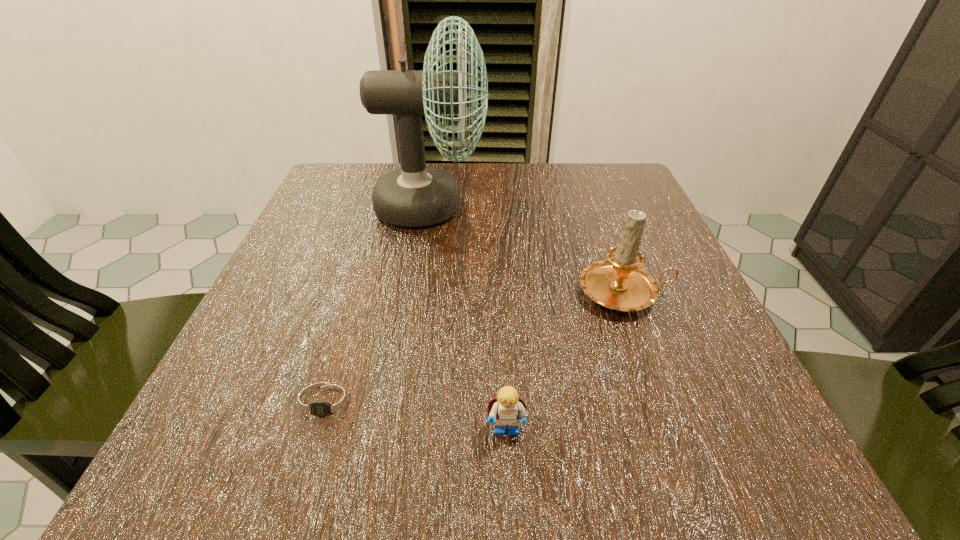
This screenshot has height=540, width=960. I want to click on the tallest object, so click(415, 195).

In order to click on the farthest object in this screenshot , I will do `click(415, 195)`.

Where is `the second tallest object`? the second tallest object is located at coordinates (619, 283).

Locate an element on the screen. candle is located at coordinates (619, 283).

Image resolution: width=960 pixels, height=540 pixels. What are the coordinates of `the third tallest object` in the screenshot? It's located at (505, 409).

Where is `watch`? The height and width of the screenshot is (540, 960). watch is located at coordinates (326, 404).

Where is `vacant space situated 0.300m in front of the fan where the airflow is directed`? Image resolution: width=960 pixels, height=540 pixels. vacant space situated 0.300m in front of the fan where the airflow is directed is located at coordinates (626, 206).

Image resolution: width=960 pixels, height=540 pixels. Identify the location of vacant space located 0.060m on the left of the rightmost object. (543, 293).

The width and height of the screenshot is (960, 540). In order to click on free space located 0.060m on the face of the shortest object in this screenshot , I will do `click(301, 491)`.

This screenshot has height=540, width=960. Find the location of `object at the far edge`. object at the far edge is located at coordinates (415, 195).